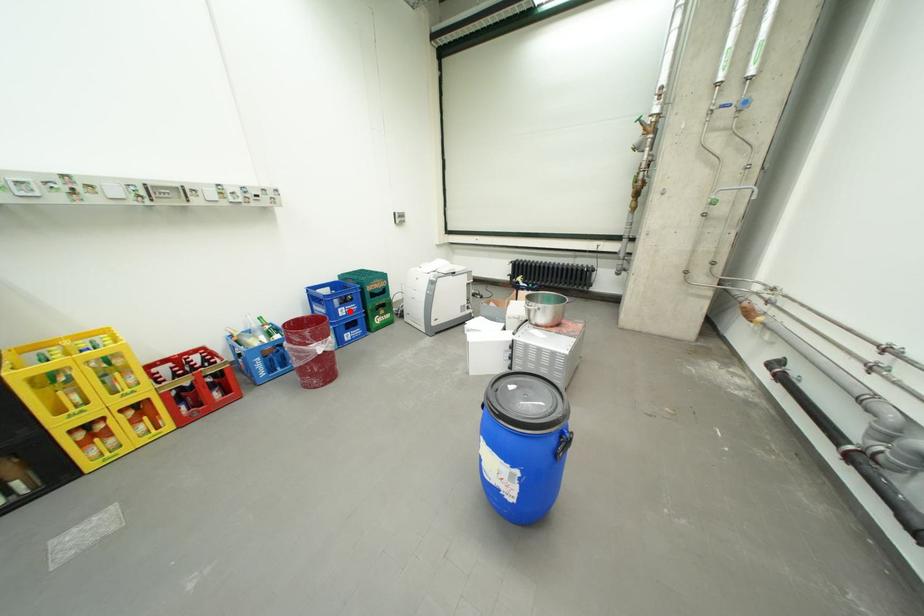
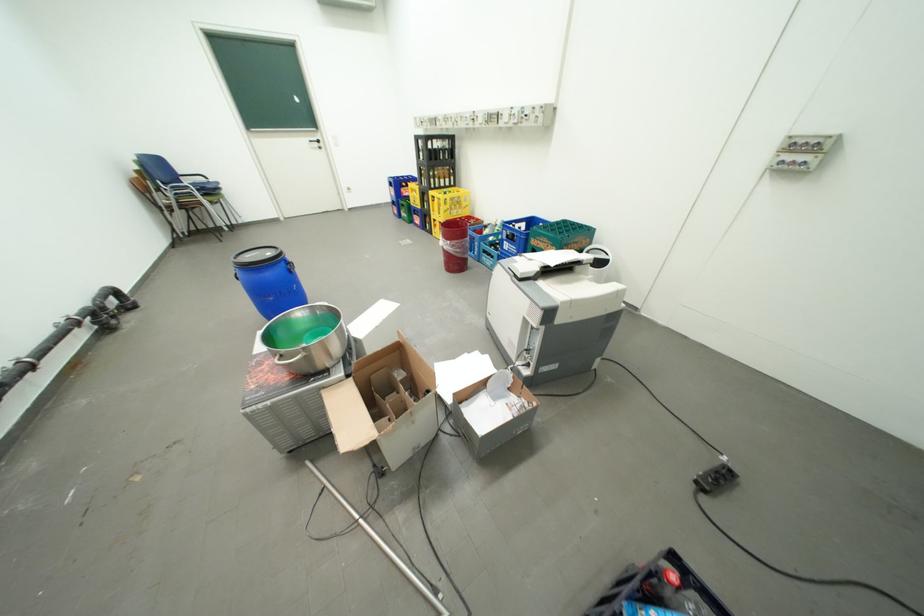
Locate, in the second image, the point that corresponds to the highlighted location in the first image.

(516, 244)